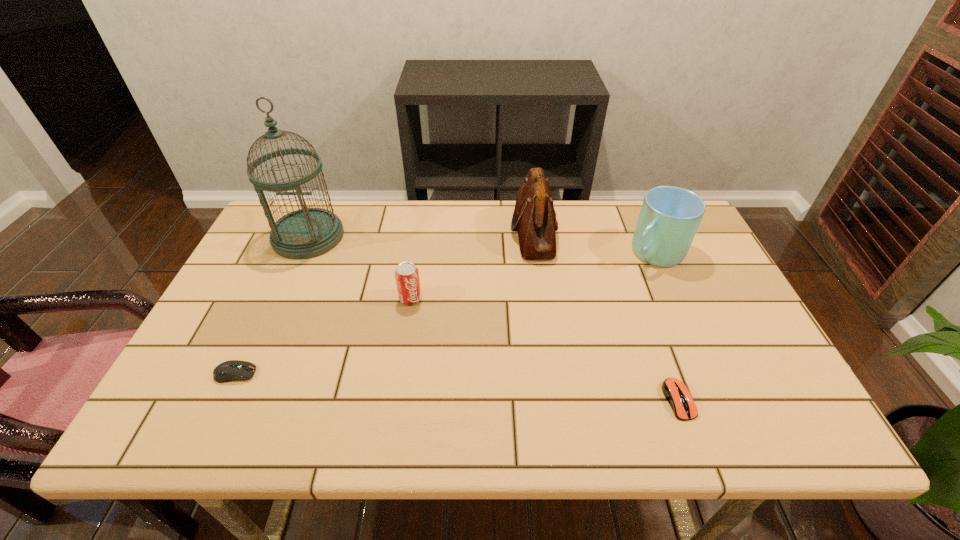
The width and height of the screenshot is (960, 540). Find the location of `birdcage`. birdcage is located at coordinates (308, 232).

I want to click on the second tallest object, so click(x=534, y=218).

What are the coordinates of `the fourth object from left to right` in the screenshot? It's located at (534, 218).

You are a GUI agent. You are given a task and a screenshot of the screen. Output one action in this format:
    pyautogui.click(x=<x>, y=<y>)
    Task: Click on the fourth shortest object
    
    Given the screenshot: What is the action you would take?
    pyautogui.click(x=670, y=216)

The width and height of the screenshot is (960, 540). Find the location of `the fourth tallest object`. the fourth tallest object is located at coordinates (407, 279).

The height and width of the screenshot is (540, 960). I want to click on the fourth farthest object, so click(407, 279).

Where is `the left computer mouse`? Image resolution: width=960 pixels, height=540 pixels. the left computer mouse is located at coordinates (233, 370).

At what (x,y) coordinates should I click in order to perform the action: click on the shorter computer mouse. Please return your answer as a coordinate pair (x, y). This screenshot has height=540, width=960. Looking at the image, I should click on (677, 394).

The height and width of the screenshot is (540, 960). Identify the location of the shortest object. tap(677, 394).

Locate an element on the screen. This screenshot has height=540, width=960. free region located on the front-facing side of the birdcage is located at coordinates (292, 274).